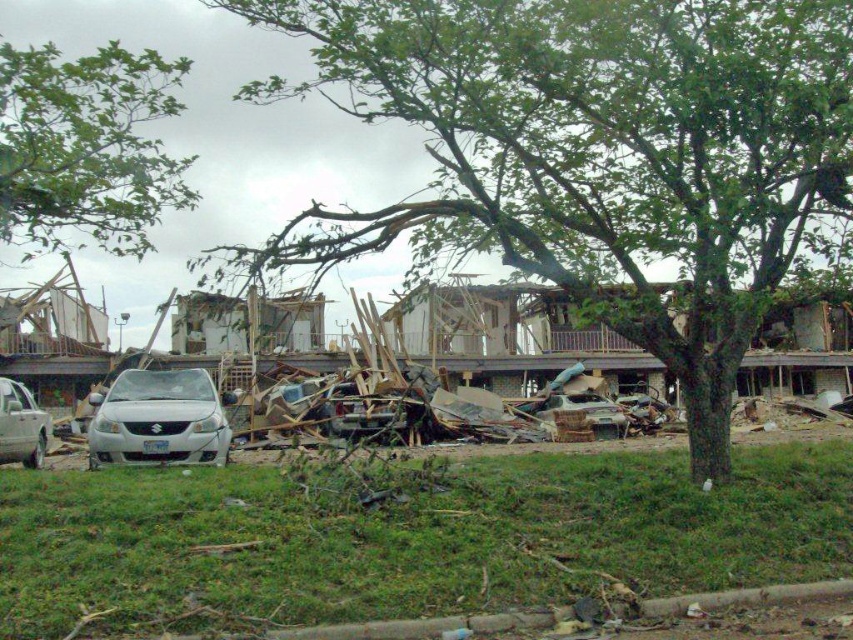
You are a tow truck operator who needs to tow both the white matte car at center and the rusty metallic car at center from the disaster site. Given their sizes, which car should you tow first to ensure you can fit both on your trailer?

The white matte car at center is larger in size than the rusty metallic car at center, so you should tow the rusty metallic car at center first to ensure both fit on the trailer.